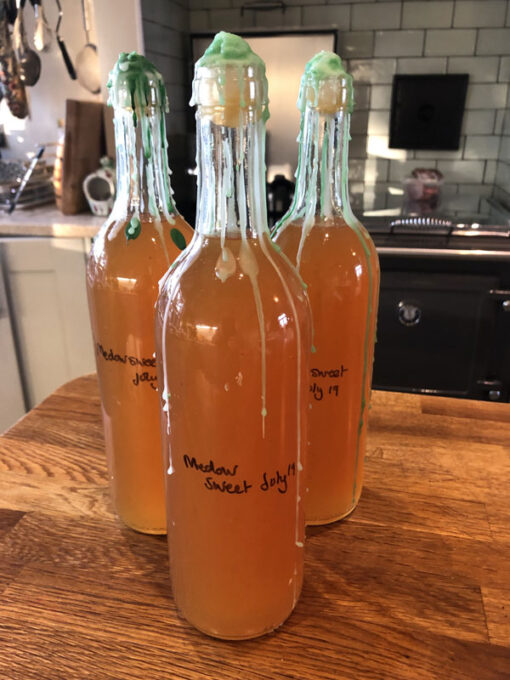
Find the location of a particular element. Image resolution: width=510 pixels, height=680 pixels. wooden tabletop is located at coordinates (476, 470).